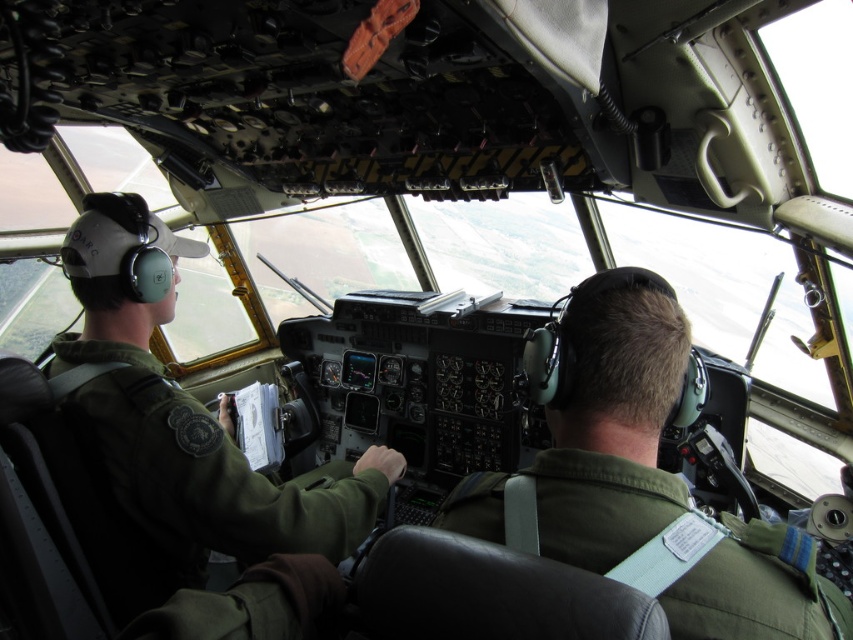
Does green fabric pilot at center have a lesser height compared to green fabric uniform at left?

Correct, green fabric pilot at center is not as tall as green fabric uniform at left.

Is green fabric pilot at center closer to the viewer compared to green fabric uniform at left?

Yes.

Measure the distance between point (498, 483) and camera.

Point (498, 483) and camera are 3.40 feet apart.

Where is `green fabric pilot at center`? The height and width of the screenshot is (640, 853). green fabric pilot at center is located at coordinates (639, 480).